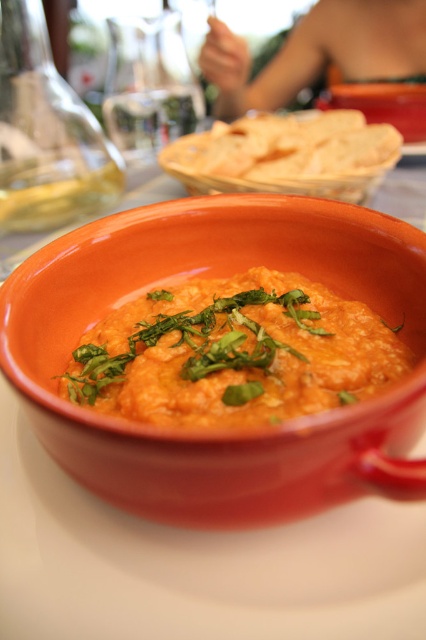
Which is below, matte ceramic bowl at center or matte orange dip at center?

Positioned lower is matte orange dip at center.

Between matte ceramic bowl at center and matte orange dip at center, which one has less height?

matte orange dip at center

Between point (267, 225) and point (181, 355), which one is positioned in front?

Point (181, 355)

In order to click on matte ceramic bowl at center in this screenshot , I will do `click(210, 435)`.